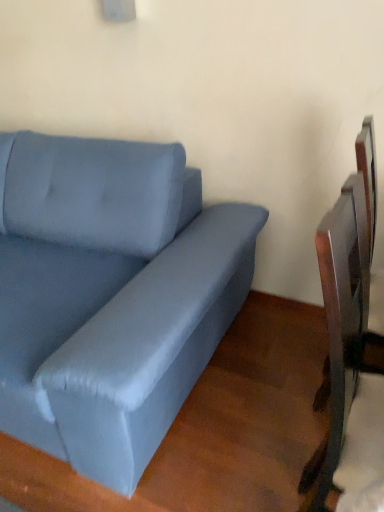
Question: In terms of size, does metallic silver swivel chair at right appear bigger or smaller than satin blue couch at left?

Choices:
 (A) small
 (B) big

Answer: (A)

Question: Which is correct: metallic silver swivel chair at right is inside satin blue couch at left, or outside of it?

Choices:
 (A) inside
 (B) outside

Answer: (B)

Question: Looking at their shapes, would you say metallic silver swivel chair at right is wider or thinner than satin blue couch at left?

Choices:
 (A) wide
 (B) thin

Answer: (B)

Question: Visually, is satin blue couch at left positioned to the left or to the right of metallic silver swivel chair at right?

Choices:
 (A) left
 (B) right

Answer: (A)

Question: Considering their positions, is satin blue couch at left located in front of or behind metallic silver swivel chair at right?

Choices:
 (A) behind
 (B) front

Answer: (B)

Question: Is point (157, 246) closer or farther from the camera than point (360, 244)?

Choices:
 (A) farther
 (B) closer

Answer: (A)

Question: From a real-world perspective, relative to metallic silver swivel chair at right, is satin blue couch at left vertically above or below?

Choices:
 (A) above
 (B) below

Answer: (B)